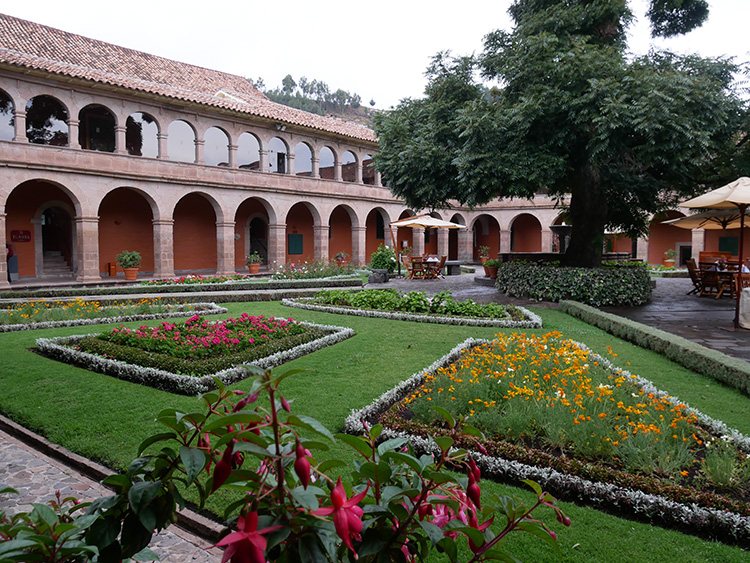
I want to click on table shade, so click(738, 193), click(722, 216).